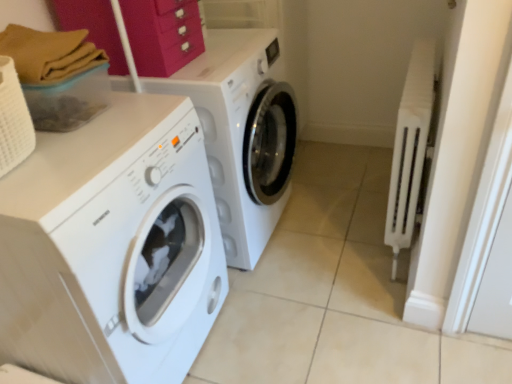
At what (x,y) coordinates should I click in order to perform the action: click on vacant space to the right of matte pink drawer at upper center. Please return your answer as a coordinate pair (x, y). The width and height of the screenshot is (512, 384). Looking at the image, I should click on (222, 56).